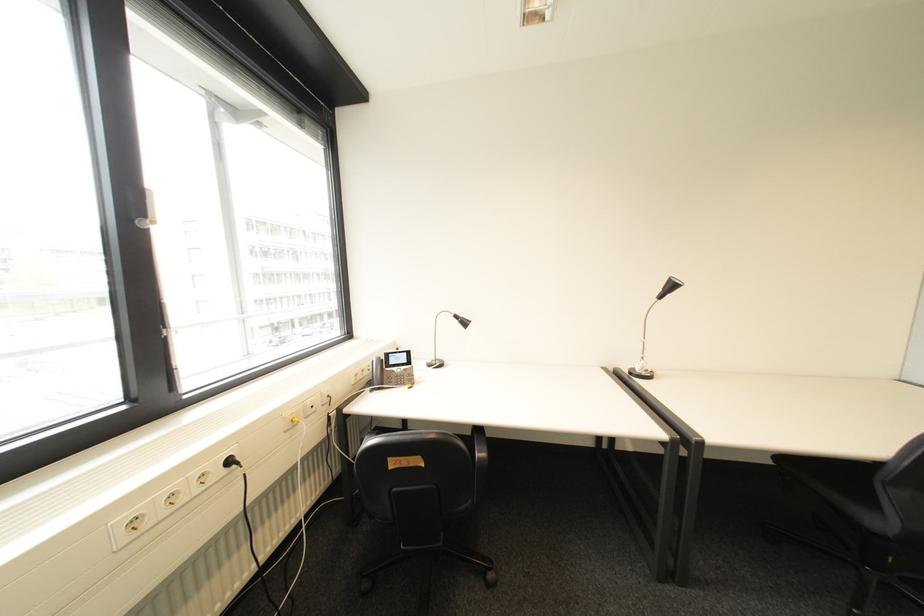
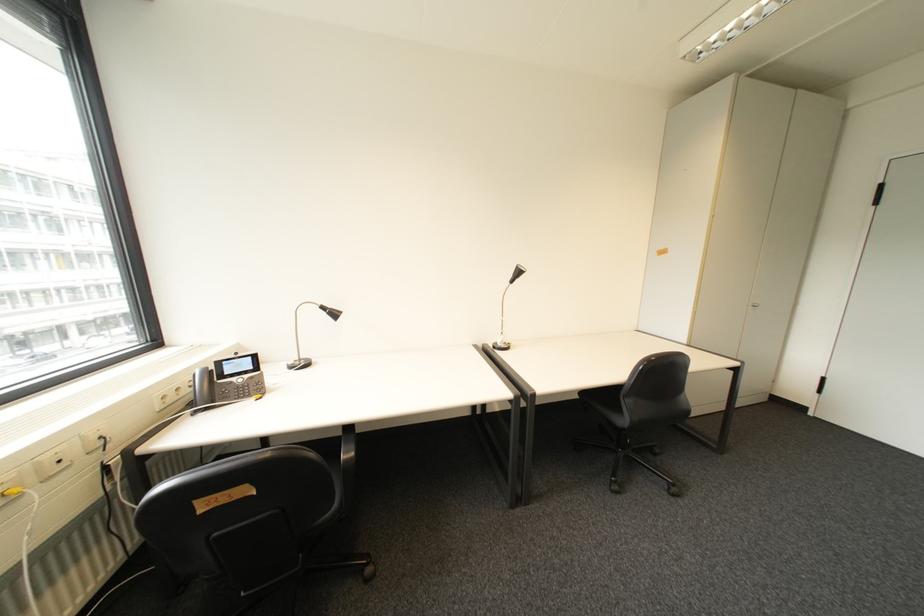
Question: Which direction would the cameraman need to move to produce the second image? Reply with the corresponding letter.

Choices:
 (A) Left
 (B) Right
 (C) Forward
 (D) Backward

Answer: (B)